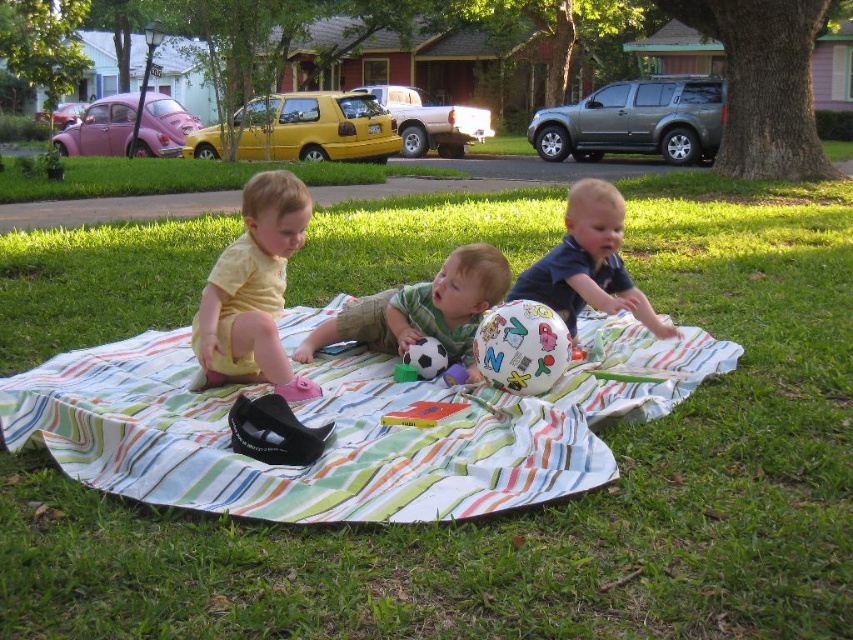
Question: Can you confirm if striped cotton blanket at center is smaller than multicolored rubber ball at center?

Choices:
 (A) yes
 (B) no

Answer: (B)

Question: Considering the real-world distances, which object is farthest from the yellow matte shirt at left?

Choices:
 (A) striped cotton blanket at center
 (B) yellow matte van at center

Answer: (B)

Question: Considering the relative positions of green grass at center and yellow matte shirt at left in the image provided, where is green grass at center located with respect to yellow matte shirt at left?

Choices:
 (A) left
 (B) right

Answer: (B)

Question: Which is nearer to the green matte shirt at center?

Choices:
 (A) multicolored rubber ball at center
 (B) blue matte shirt at center
 (C) striped cotton blanket at center
 (D) green grass at center

Answer: (A)

Question: Is blue matte shirt at center to the left of rubberized plastic toy at center from the viewer's perspective?

Choices:
 (A) no
 (B) yes

Answer: (A)

Question: Which object is positioned farthest from the blue matte shirt at center?

Choices:
 (A) green matte shirt at center
 (B) rubberized plastic toy at center

Answer: (B)